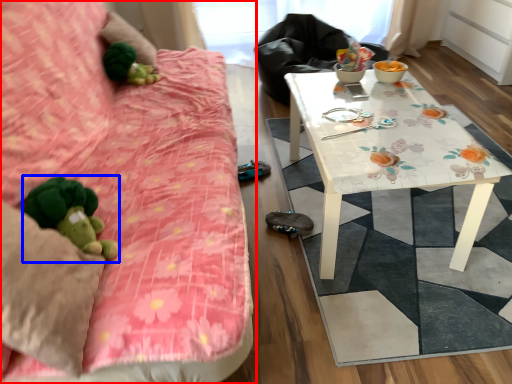
Question: Which point is closer to the camera, studio couch (highlighted by a red box) or toy (highlighted by a blue box)?

Choices:
 (A) studio couch
 (B) toy

Answer: (A)